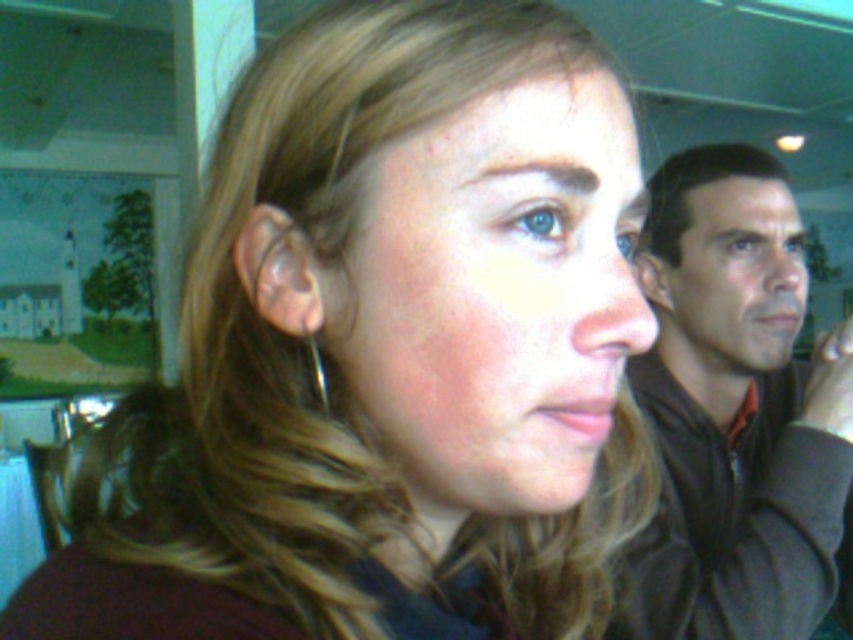
Question: Can you confirm if brown fabric jacket at right is positioned to the right of silver metallic earring at ear?

Choices:
 (A) yes
 (B) no

Answer: (A)

Question: Which of the following is the closest to the observer?

Choices:
 (A) silver metallic earring at ear
 (B) brown fabric jacket at right
 (C) dark brown hair at upper right

Answer: (A)

Question: Which object appears closest to the camera in this image?

Choices:
 (A) dark brown hair at upper right
 (B) silver metallic earring at ear

Answer: (B)

Question: Considering the real-world distances, which object is closest to the brown fabric jacket at right?

Choices:
 (A) silver metallic earring at ear
 (B) dark brown hair at upper right

Answer: (B)

Question: Can you confirm if brown fabric jacket at right is bigger than silver metallic earring at ear?

Choices:
 (A) yes
 (B) no

Answer: (A)

Question: Does brown fabric jacket at right appear on the right side of silver metallic earring at ear?

Choices:
 (A) yes
 (B) no

Answer: (A)